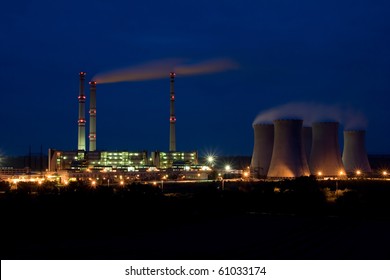
Where is `green lights`? The height and width of the screenshot is (280, 390). green lights is located at coordinates (114, 158).